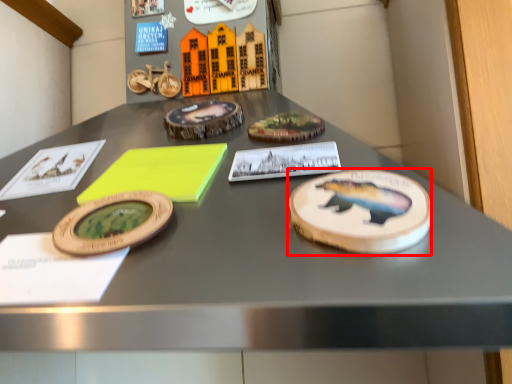
Question: From the image, what is the correct spatial relationship of cake (annotated by the red box) in relation to notepad?

Choices:
 (A) right
 (B) left

Answer: (A)